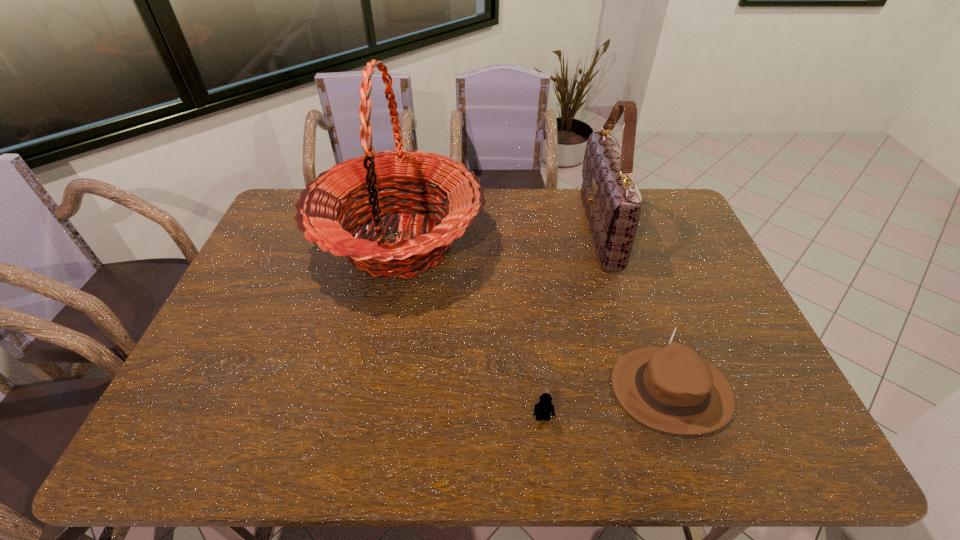
You are a GUI agent. You are given a task and a screenshot of the screen. Output one action in this format:
    pyautogui.click(x=<x>, y=<y>)
    Task: Click on the vacant position at the far edge of the desktop
    
    Given the screenshot: What is the action you would take?
    pyautogui.click(x=531, y=222)

In the image, there is a desktop. Where is `vacant area at the near edge`? vacant area at the near edge is located at coordinates (334, 427).

Where is `vacant region at the left edge of the desktop`? vacant region at the left edge of the desktop is located at coordinates (304, 238).

You are a GUI agent. You are given a task and a screenshot of the screen. Output one action in this format:
    pyautogui.click(x=<x>, y=<y>)
    Task: Click on the vacant area at the right edge
    
    Given the screenshot: What is the action you would take?
    pyautogui.click(x=683, y=254)

In order to click on free space at the near left corner of the desktop in this screenshot , I will do `click(220, 445)`.

This screenshot has height=540, width=960. In the image, there is a desktop. In order to click on vacant space at the near right corner in this screenshot , I will do `click(734, 441)`.

At what (x,y) coordinates should I click in order to perform the action: click on vacant space that's between the second shortest object and the leftmost object. Please return your answer as a coordinate pair (x, y). Looking at the image, I should click on (536, 316).

Find the location of a particular element. This screenshot has width=960, height=540. unoccupied area between the basket and the third shortest object is located at coordinates (499, 237).

The height and width of the screenshot is (540, 960). I want to click on free space between the handbag and the basket, so click(499, 237).

Find the location of a particular element. blank region between the third shortest object and the third tallest object is located at coordinates (636, 309).